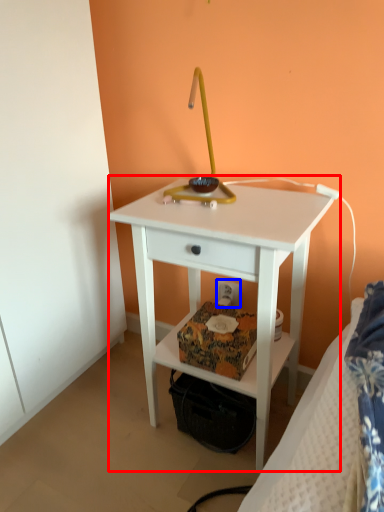
Question: Which point is further to the camera, nightstand (highlighted by a red box) or electric outlet (highlighted by a blue box)?

Choices:
 (A) nightstand
 (B) electric outlet

Answer: (B)